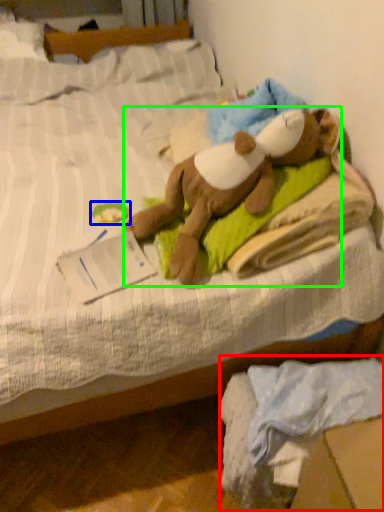
Question: Based on their relative distances, which object is farther from material (highlighted by a red box)? Choose from toy (highlighted by a blue box) and person (highlighted by a green box).

Choices:
 (A) toy
 (B) person

Answer: (A)